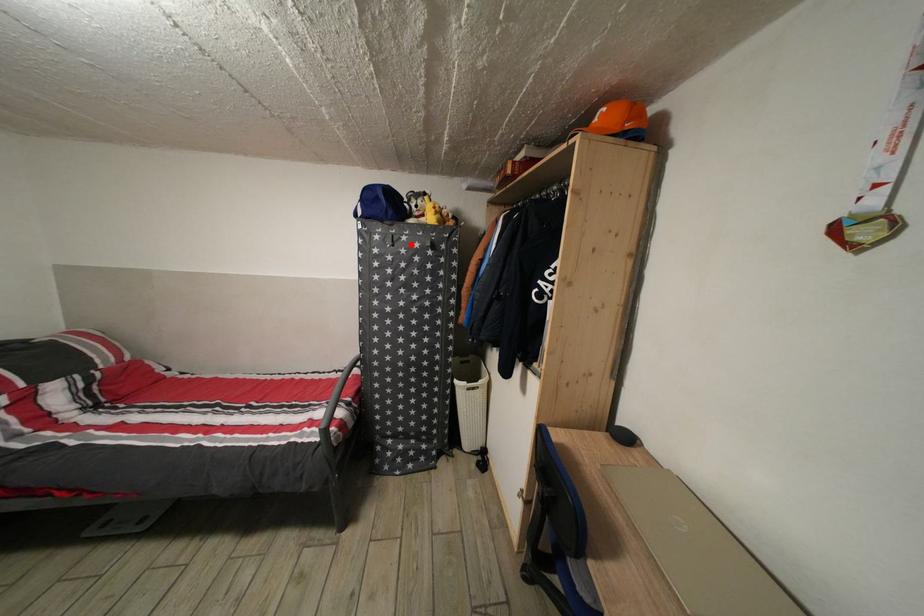
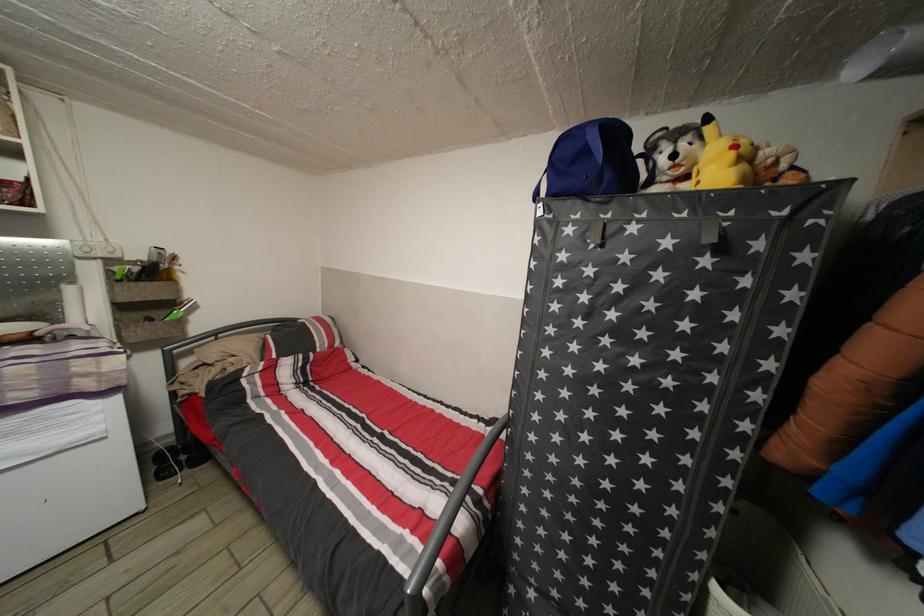
Where in the second image is the point corresponding to the highlighted location from the first image?

(639, 235)